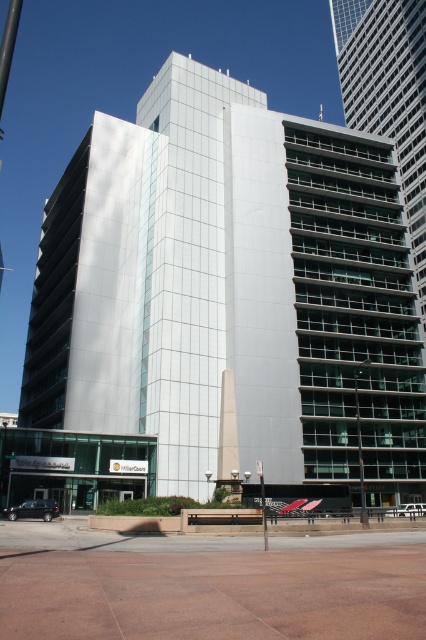
You are a city planner assessing the space in front of the building. You need to install a new bench that requires a 1.2 meter width. The bench will be placed between the metallic pole at right and the white plastic street sign at center. Can the space between them accommodate the bench?

The metallic pole at right might be wider than white plastic street sign at center, so the space between them may not be sufficient to fit the 1.2 meter bench. Further measurement is needed to confirm.